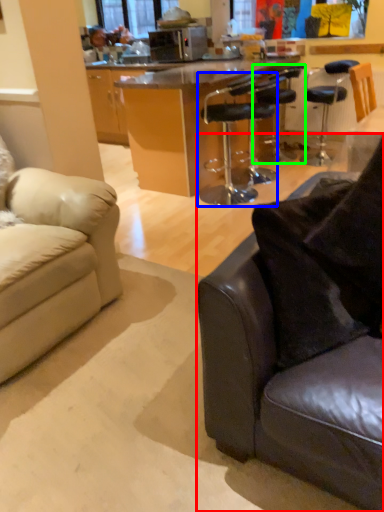
Question: Based on their relative distances, which object is farther from studio couch (highlighted by a red box)? Choose from chair (highlighted by a blue box) and chair (highlighted by a green box).

Choices:
 (A) chair
 (B) chair

Answer: (B)